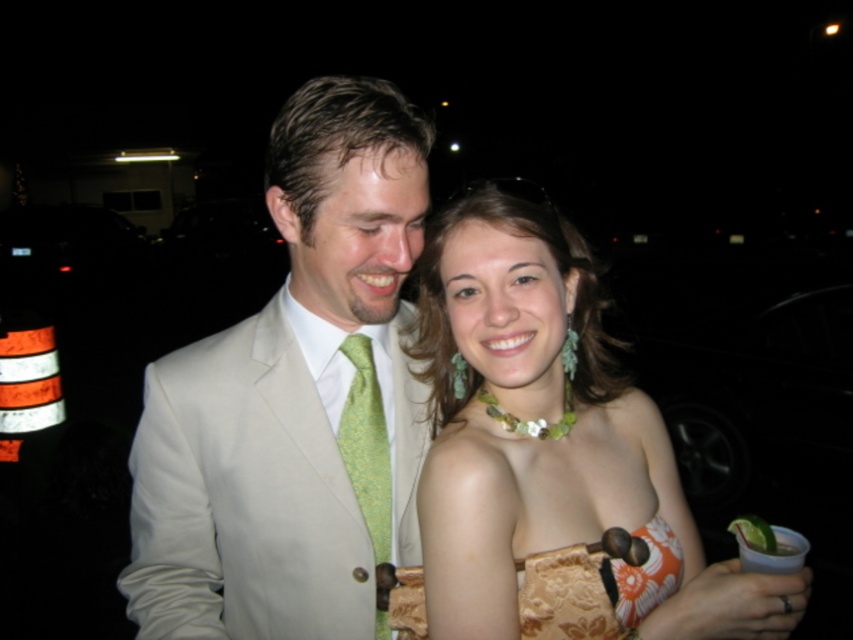
Question: Is matte green necklace at center to the left of gold brocade clutch at lower center from the viewer's perspective?

Choices:
 (A) no
 (B) yes

Answer: (A)

Question: Does light beige suit at center lie in front of white satin suit at center?

Choices:
 (A) no
 (B) yes

Answer: (A)

Question: Among these points, which one is farthest from the camera?

Choices:
 (A) (677, 600)
 (B) (349, 410)
 (C) (660, 540)

Answer: (B)

Question: Which of these objects is positioned farthest from the green textured tie at center?

Choices:
 (A) white satin suit at center
 (B) matte green necklace at center
 (C) gold brocade clutch at lower center
 (D) light beige suit at center

Answer: (C)

Question: Estimate the real-world distances between objects in this image. Which object is closer to the gold brocade clutch at lower center?

Choices:
 (A) light beige suit at center
 (B) matte green necklace at center
 (C) white satin suit at center

Answer: (B)

Question: Is matte green necklace at center thinner than gold brocade clutch at lower center?

Choices:
 (A) no
 (B) yes

Answer: (A)